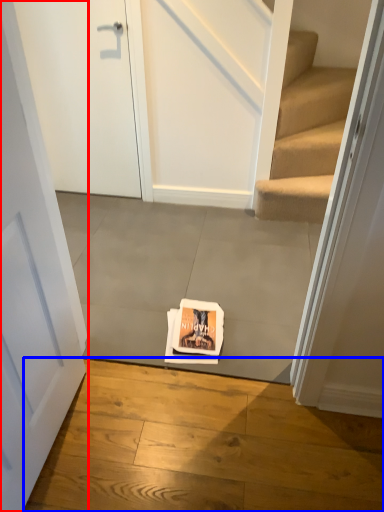
Question: Which object appears farthest to the camera in this image, door (highlighted by a red box) or concrete (highlighted by a blue box)?

Choices:
 (A) door
 (B) concrete

Answer: (B)